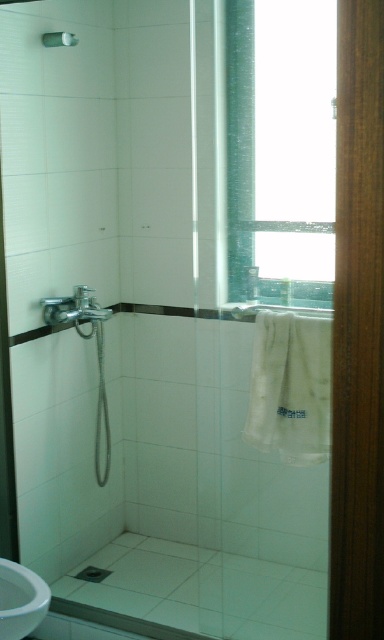
You are standing in the bathroom and want to locate the brushed metal faucet at left and the silver metallic towel bar at upper center. According to their positions, which object is closer to the shower area?

The brushed metal faucet at left is closer to the shower area because it is positioned to the right of the silver metallic towel bar at upper center, which suggests it is nearer to the shower enclosure.

You are a contractor measuring bathroom fixtures for a renovation project. You need to determine if the brushed metal faucet at left can fit into a space that is currently occupied by the silver metallic towel bar at upper center. Based on their widths, will the faucet fit into the space where the towel bar is?

The brushed metal faucet at left is wider than the silver metallic towel bar at upper center, so it will not fit into the space currently occupied by the silver metallic towel bar at upper center.

You are standing in the bathroom and see a point marked at coordinates [281,150]. Based on the scene description, can you determine what object this point is located on?

The point [281,150] is located on the transparent glass window at upper center.